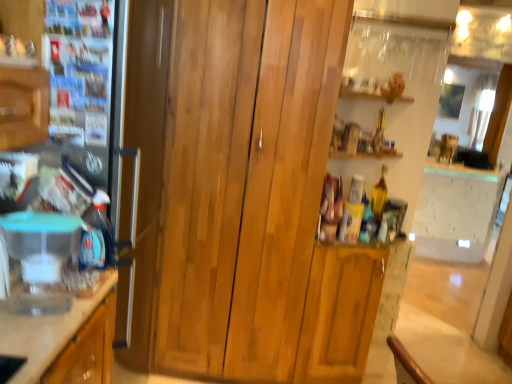
This screenshot has height=384, width=512. What are the coordinates of `vacant space situated above clear plastic container at left (from a real-world perspective)` in the screenshot? It's located at (31, 306).